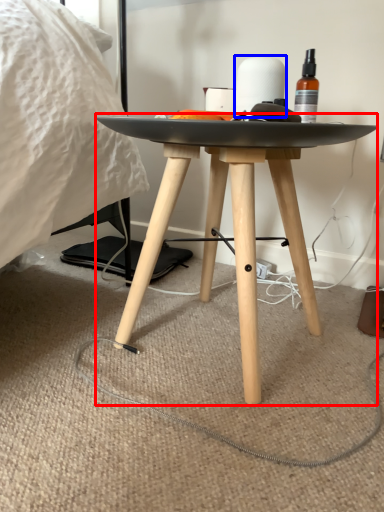
Question: Which point is closer to the camera, table (highlighted by a red box) or toilet paper (highlighted by a blue box)?

Choices:
 (A) table
 (B) toilet paper

Answer: (A)